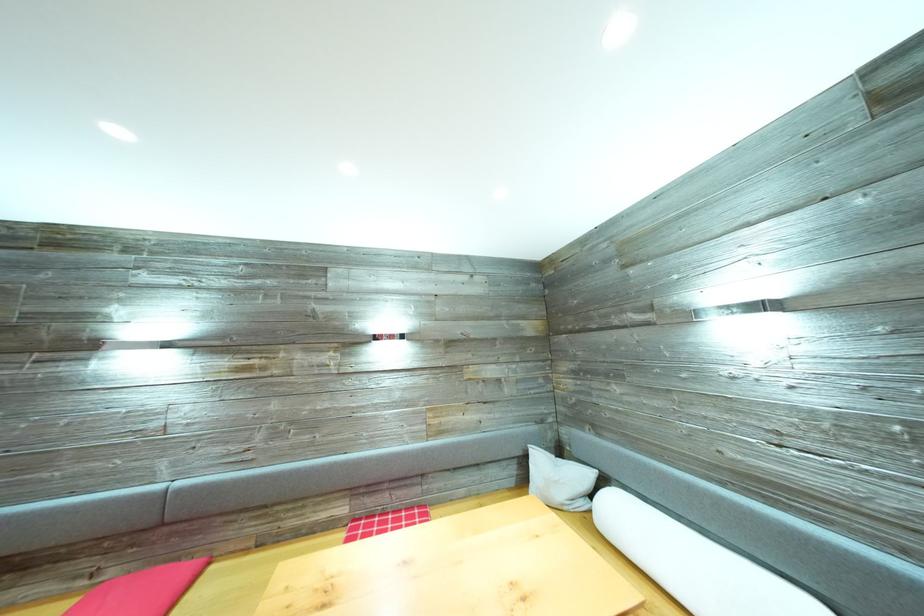
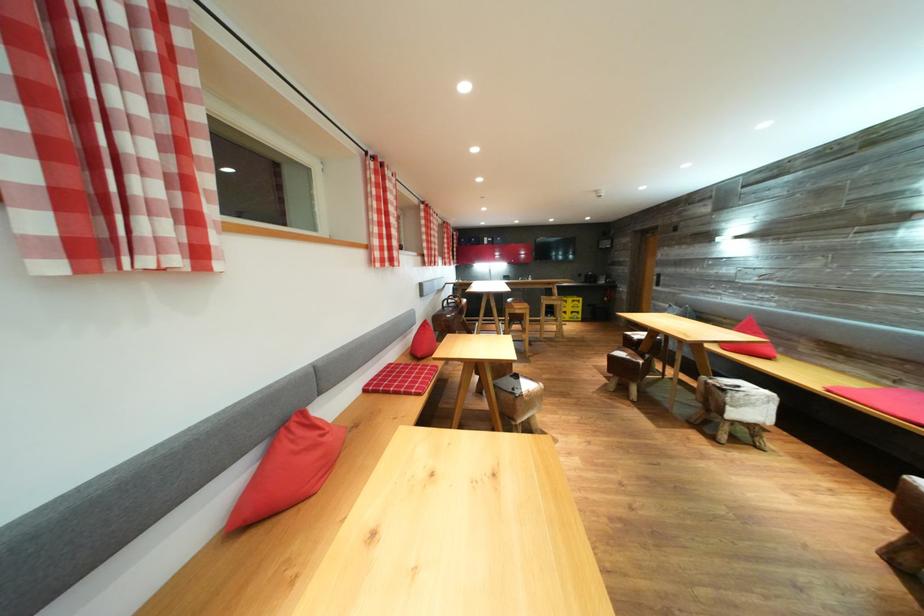
Locate, in the second image, the point that corresponds to pixel 91 588 in the first image.

(895, 389)